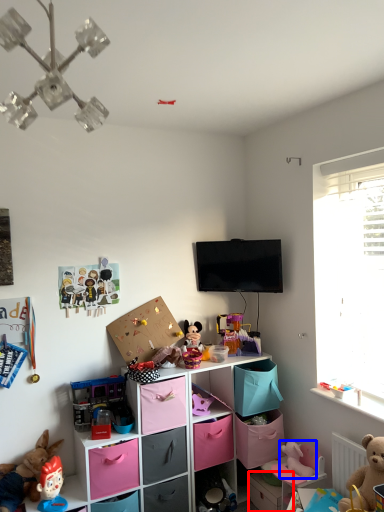
Question: Which object is closer to the camera taking this photo, storage box (highlighted by a red box) or toy (highlighted by a blue box)?

Choices:
 (A) storage box
 (B) toy

Answer: (B)